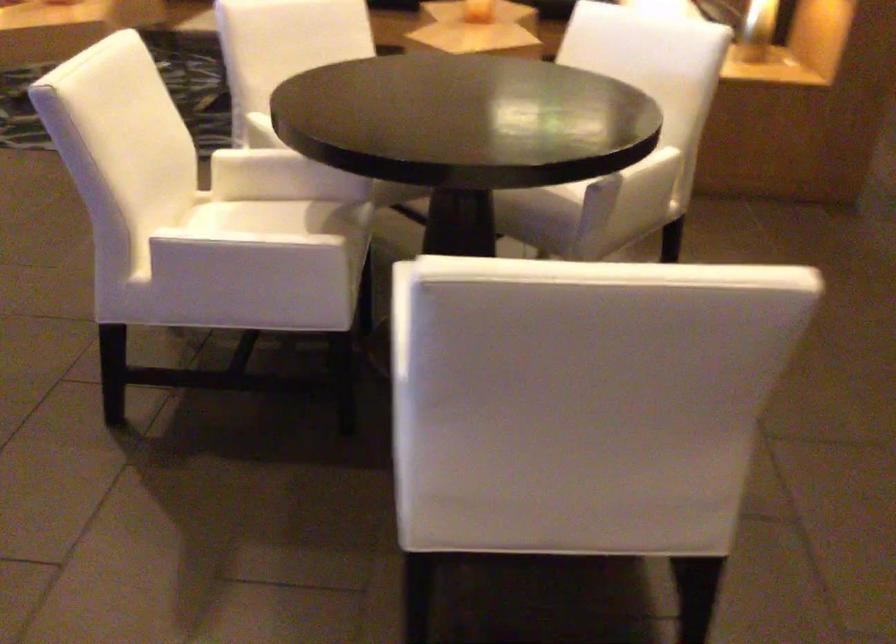
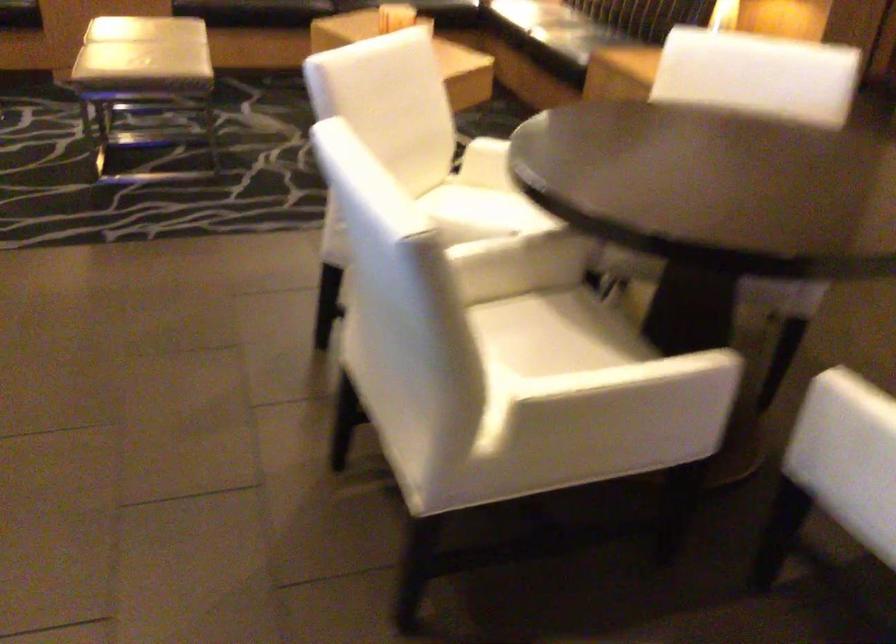
What movement of the cameraman would produce the second image?

The cameraman walked toward left, forward.